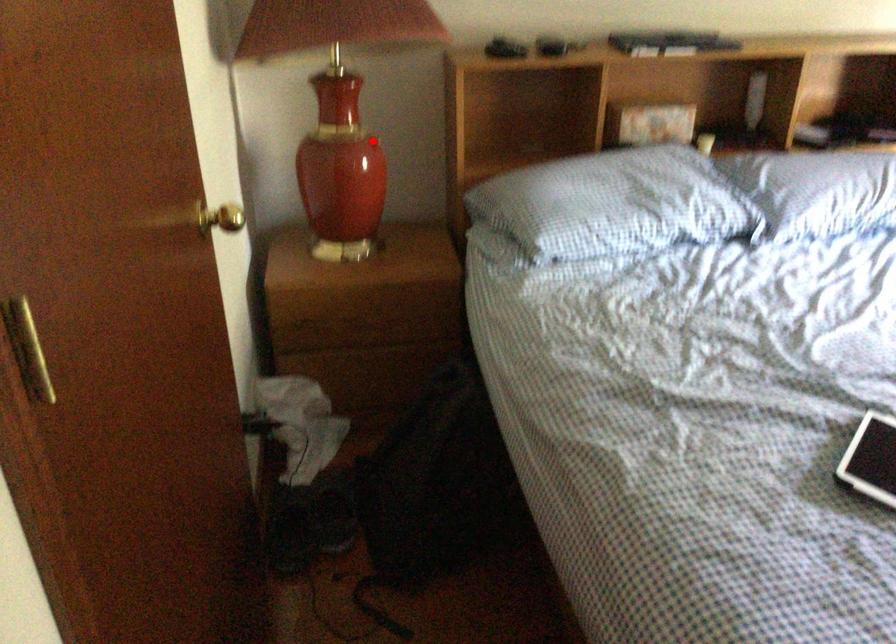
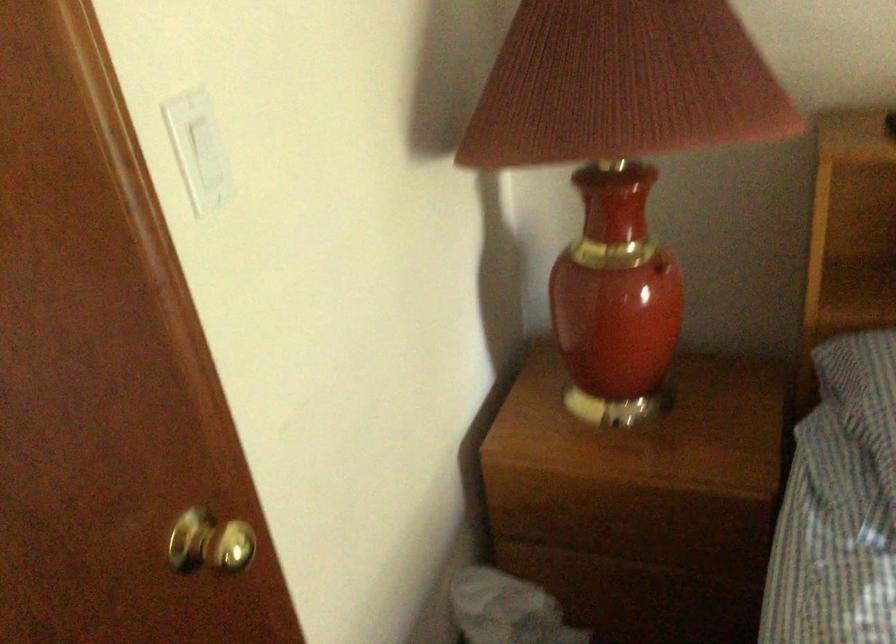
Question: I am providing you with two images of the same scene from different viewpoints. Given a red point in image1, look at the same physical point in image2. Is it:

Choices:
 (A) Closer to the viewpoint
 (B) Farther from the viewpoint

Answer: (A)